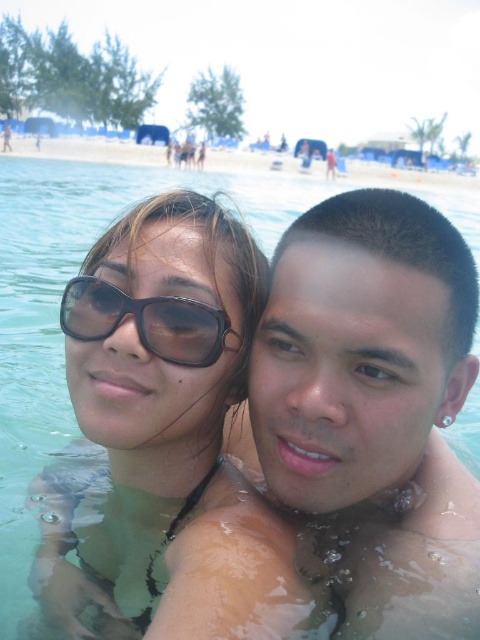
Is black plastic sunglasses at center wider than clear sand at upper center?

No.

Measure the distance between black plastic sunglasses at center and clear sand at upper center.

55.08 meters

Between point (119, 323) and point (396, 182), which one is positioned in front?

Point (119, 323)

Locate an element on the screen. The image size is (480, 640). black plastic sunglasses at center is located at coordinates (145, 321).

Is shiny skin at center smaller than black plastic sunglasses at center?

Incorrect, shiny skin at center is not smaller in size than black plastic sunglasses at center.

Identify the location of shiny skin at center. (372, 410).

Which is more to the left, matte black sunglasses at center or clear sand at upper center?

From the viewer's perspective, matte black sunglasses at center appears more on the left side.

Between point (141, 380) and point (76, 152), which one is positioned behind?

Positioned behind is point (76, 152).

Find the location of a particular element. Image resolution: width=480 pixels, height=640 pixels. matte black sunglasses at center is located at coordinates (156, 432).